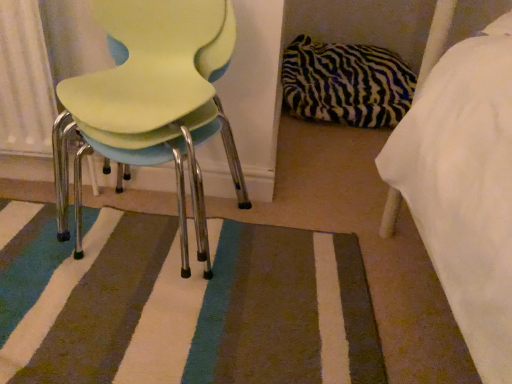
The width and height of the screenshot is (512, 384). What are the coordinates of `vacant space underneath striped carpet at center (from a real-world perspective)` in the screenshot? It's located at (191, 321).